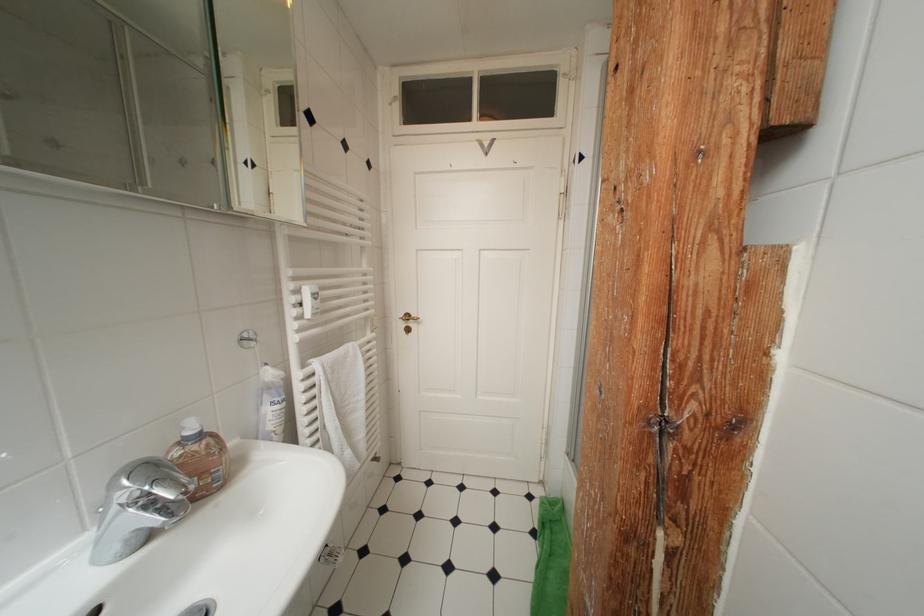
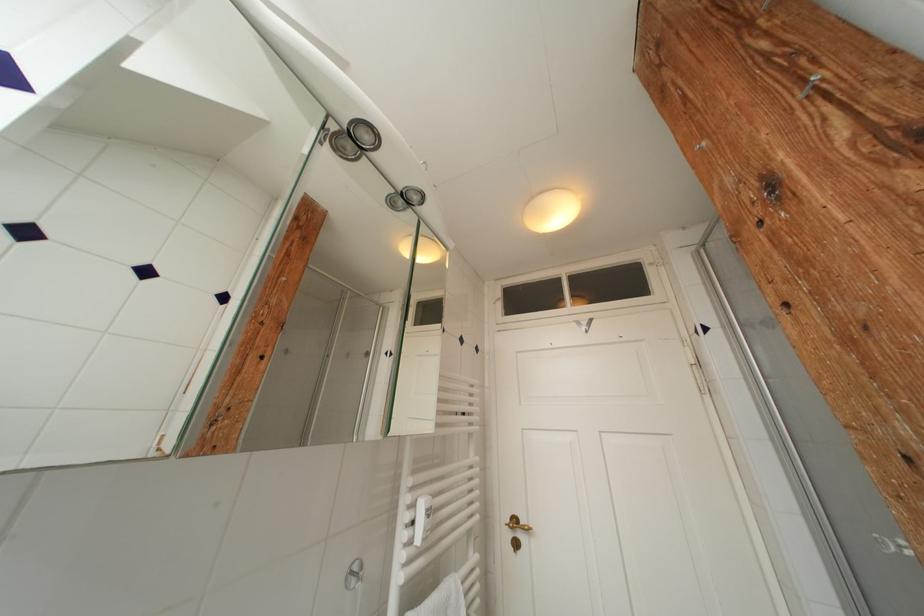
In the second image, find the point that corresponds to (x=415, y=320) in the first image.

(521, 525)